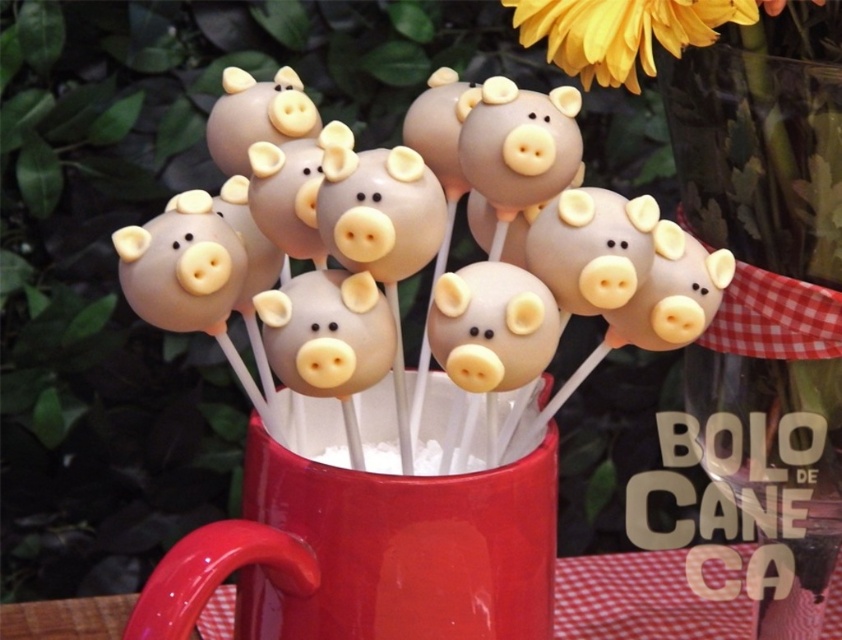
Consider the image. Does matte ceramic mug at center have a smaller size compared to yellow matte flower at upper center?

Incorrect, matte ceramic mug at center is not smaller in size than yellow matte flower at upper center.

I want to click on matte ceramic mug at center, so click(x=368, y=554).